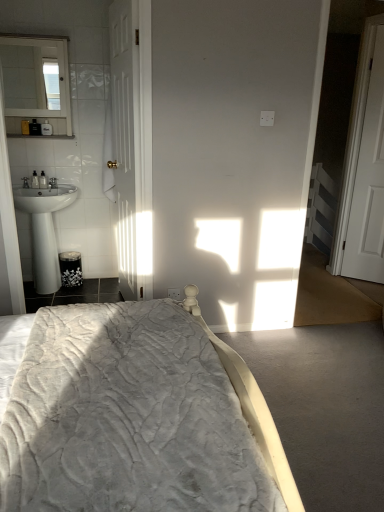
Question: Is the depth of white wooden door at right, which appears as the 2th door when viewed from the left, less than that of white glossy sink at left?

Choices:
 (A) no
 (B) yes

Answer: (A)

Question: Can you confirm if white wooden door at right, placed as the 1th door when sorted from right to left, is wider than white glossy sink at left?

Choices:
 (A) no
 (B) yes

Answer: (A)

Question: Can you confirm if white wooden door at right, placed as the 1th door when sorted from right to left, is positioned to the left of white glossy sink at left?

Choices:
 (A) yes
 (B) no

Answer: (B)

Question: From a real-world perspective, is white wooden door at right, which appears as the 2th door when viewed from the left, over white glossy sink at left?

Choices:
 (A) no
 (B) yes

Answer: (B)

Question: Is white wooden door at right, placed as the 1th door when sorted from right to left, bigger than white glossy sink at left?

Choices:
 (A) yes
 (B) no

Answer: (B)

Question: From a real-world perspective, does white wooden door at right, placed as the 1th door when sorted from right to left, sit lower than white glossy sink at left?

Choices:
 (A) no
 (B) yes

Answer: (A)

Question: Considering the relative sizes of white glossy mirror at upper left and white wooden door at right, which appears as the 2th door when viewed from the left, in the image provided, is white glossy mirror at upper left taller than white wooden door at right, which appears as the 2th door when viewed from the left,?

Choices:
 (A) yes
 (B) no

Answer: (B)

Question: Would you consider white glossy mirror at upper left to be distant from white wooden door at right, which appears as the 2th door when viewed from the left?

Choices:
 (A) no
 (B) yes

Answer: (B)

Question: Can you confirm if white glossy mirror at upper left is positioned to the left of white wooden door at right, which appears as the 2th door when viewed from the left?

Choices:
 (A) yes
 (B) no

Answer: (A)

Question: Can you confirm if white glossy mirror at upper left is thinner than white wooden door at right, placed as the 1th door when sorted from right to left?

Choices:
 (A) yes
 (B) no

Answer: (B)

Question: Is white glossy mirror at upper left located outside white wooden door at right, placed as the 1th door when sorted from right to left?

Choices:
 (A) yes
 (B) no

Answer: (A)

Question: Is white glossy mirror at upper left wider than white wooden door at right, which appears as the 2th door when viewed from the left?

Choices:
 (A) yes
 (B) no

Answer: (A)

Question: Could you tell me if white wooden door at left, the 1th door positioned from the left, is turned towards white wooden door at right, which appears as the 2th door when viewed from the left?

Choices:
 (A) yes
 (B) no

Answer: (B)